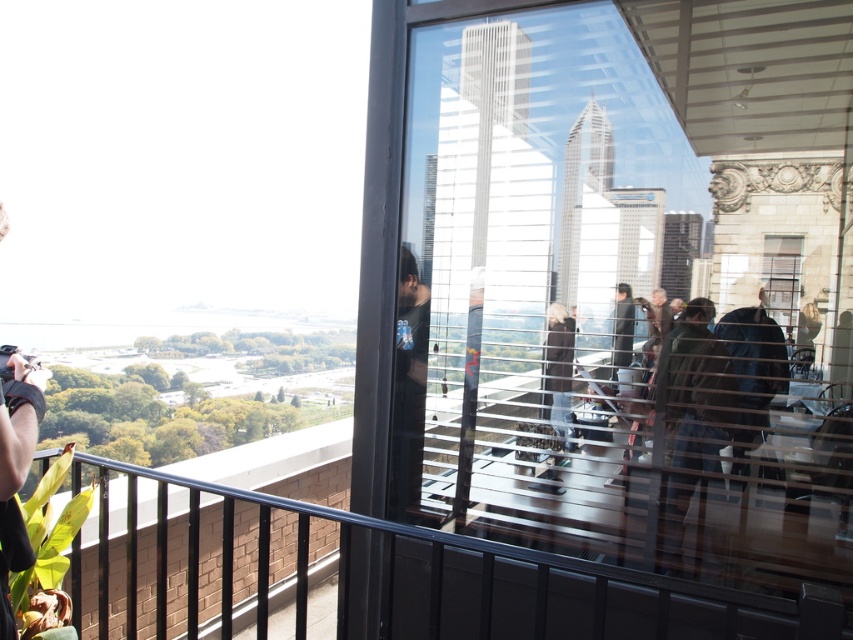
Question: Does dark brown leather jacket at center appear on the right side of matte black camera at left?

Choices:
 (A) no
 (B) yes

Answer: (B)

Question: Which object appears farthest from the camera in this image?

Choices:
 (A) black t-shirt at center
 (B) matte black camera at left
 (C) black metal balustrade at lower left

Answer: (A)

Question: Is transparent glass window at center above black t-shirt at center?

Choices:
 (A) yes
 (B) no

Answer: (A)

Question: Which is nearer to the transparent glass window at center?

Choices:
 (A) black t-shirt at center
 (B) dark brown leather jacket at center

Answer: (B)

Question: Does black metal balustrade at lower left come in front of black t-shirt at center?

Choices:
 (A) no
 (B) yes

Answer: (B)

Question: Estimate the real-world distances between objects in this image. Which object is closer to the matte black camera at left?

Choices:
 (A) transparent glass window at center
 (B) black metal balustrade at lower left

Answer: (B)